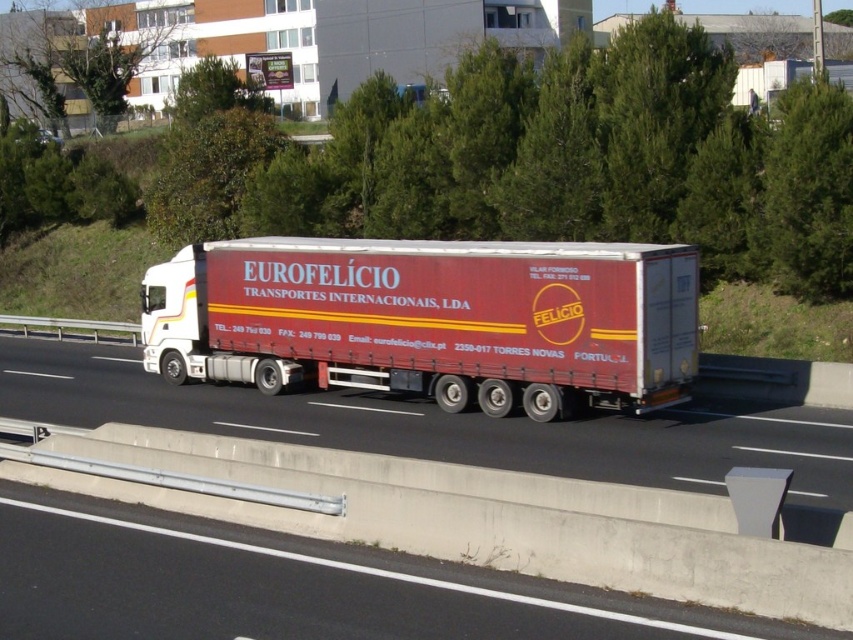
Is matte red trailer truck at center positioned at the back of white glossy highway at center?

Yes, it is.

Is matte red trailer truck at center closer to the viewer compared to white glossy highway at center?

No, it is not.

The height and width of the screenshot is (640, 853). Describe the element at coordinates (431, 320) in the screenshot. I see `matte red trailer truck at center` at that location.

Image resolution: width=853 pixels, height=640 pixels. What are the coordinates of `matte red trailer truck at center` in the screenshot? It's located at (431, 320).